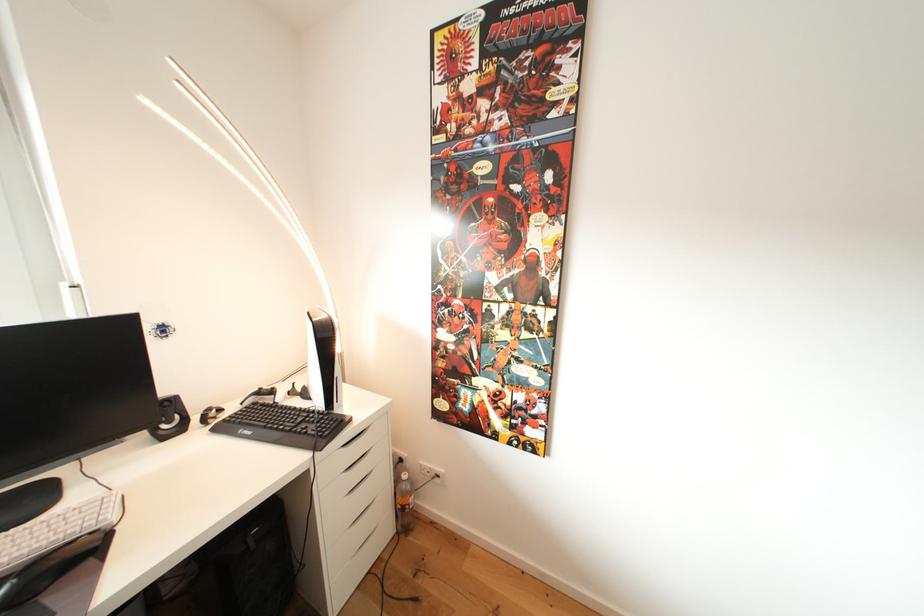
This screenshot has height=616, width=924. In order to click on black speaker in this screenshot , I will do `click(169, 419)`.